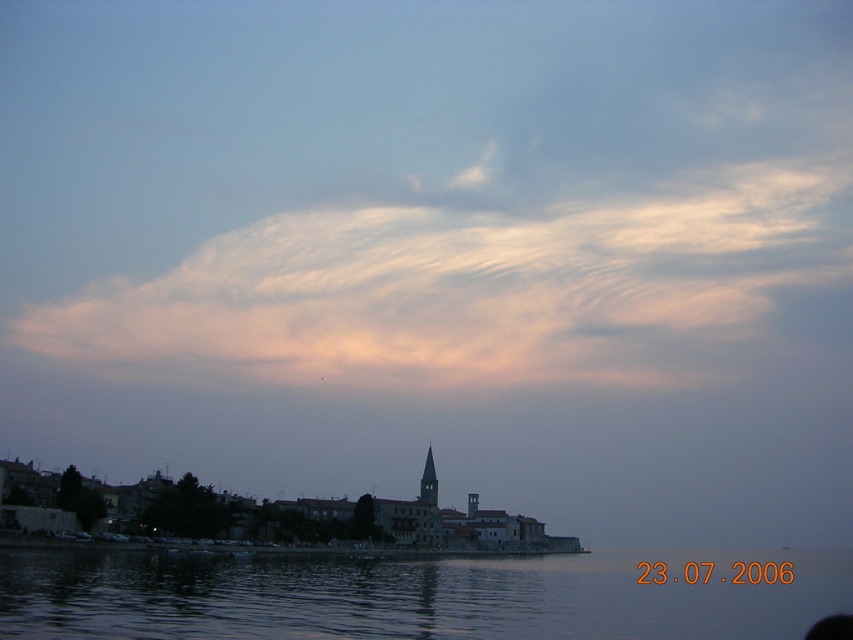
Does white fluffy cloud at upper center have a larger size compared to transparent water at lower center?

Actually, white fluffy cloud at upper center might be smaller than transparent water at lower center.

Between white fluffy cloud at upper center and transparent water at lower center, which one appears on the right side from the viewer's perspective?

From the viewer's perspective, transparent water at lower center appears more on the right side.

Is point (683, 355) less distant than point (387, 579)?

That is False.

The width and height of the screenshot is (853, 640). In order to click on white fluffy cloud at upper center in this screenshot , I will do `click(477, 289)`.

Is white fluffy cloud at upper center wider than dark gray stone tower at center?

Indeed, white fluffy cloud at upper center has a greater width compared to dark gray stone tower at center.

Between white fluffy cloud at upper center and dark gray stone tower at center, which one is positioned higher?

Positioned higher is white fluffy cloud at upper center.

Locate an element on the screen. white fluffy cloud at upper center is located at coordinates (477, 289).

The image size is (853, 640). In order to click on white fluffy cloud at upper center in this screenshot , I will do `click(477, 289)`.

Who is more distant from viewer, (x=532, y=563) or (x=434, y=472)?

The point (x=434, y=472) is more distant.

Can you confirm if transparent water at lower center is smaller than dark gray stone tower at center?

Actually, transparent water at lower center might be larger than dark gray stone tower at center.

Does point (47, 586) come behind point (421, 499)?

No, it is not.

Locate an element on the screen. This screenshot has width=853, height=640. transparent water at lower center is located at coordinates (410, 596).